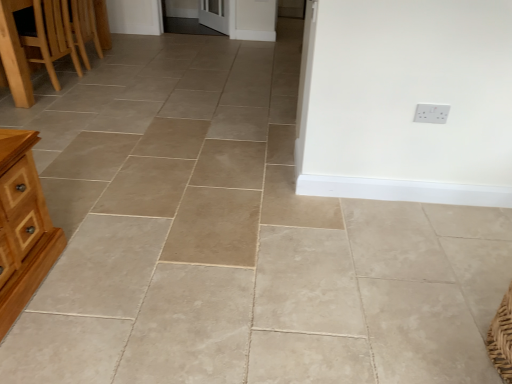
Question: From the image's perspective, is white plastic electric outlet at upper right located beneath light brown wooden table at left?

Choices:
 (A) yes
 (B) no

Answer: (A)

Question: Considering the relative sizes of white plastic electric outlet at upper right and light brown wooden table at left in the image provided, is white plastic electric outlet at upper right bigger than light brown wooden table at left?

Choices:
 (A) no
 (B) yes

Answer: (A)

Question: Could you tell me if white plastic electric outlet at upper right is facing light brown wooden table at left?

Choices:
 (A) yes
 (B) no

Answer: (B)

Question: Is white plastic electric outlet at upper right located outside light brown wooden table at left?

Choices:
 (A) no
 (B) yes

Answer: (B)

Question: Is white plastic electric outlet at upper right closer to the viewer compared to light brown wooden table at left?

Choices:
 (A) yes
 (B) no

Answer: (A)

Question: Is white plastic electric outlet at upper right at the left side of light brown wooden table at left?

Choices:
 (A) yes
 (B) no

Answer: (B)

Question: Are wooden chair at left and light brown wooden table at left located far from each other?

Choices:
 (A) yes
 (B) no

Answer: (B)

Question: Does wooden chair at left lie behind light brown wooden table at left?

Choices:
 (A) no
 (B) yes

Answer: (A)

Question: Considering the relative sizes of wooden chair at left and light brown wooden table at left in the image provided, is wooden chair at left smaller than light brown wooden table at left?

Choices:
 (A) yes
 (B) no

Answer: (B)

Question: Is wooden chair at left to the right of light brown wooden table at left from the viewer's perspective?

Choices:
 (A) yes
 (B) no

Answer: (B)

Question: From a real-world perspective, is wooden chair at left positioned under light brown wooden table at left based on gravity?

Choices:
 (A) yes
 (B) no

Answer: (B)

Question: From a real-world perspective, is wooden chair at left located higher than light brown wooden table at left?

Choices:
 (A) yes
 (B) no

Answer: (A)

Question: Is light brown wooden table at left thinner than white plastic electric outlet at upper right?

Choices:
 (A) no
 (B) yes

Answer: (A)